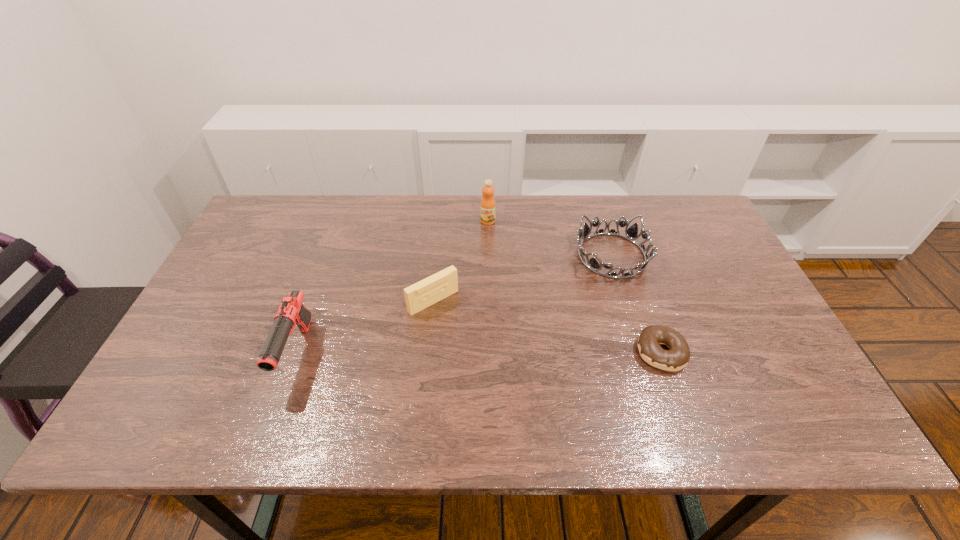
Locate an element on the screen. The height and width of the screenshot is (540, 960). free space between the farthest object and the videotape is located at coordinates (461, 261).

Image resolution: width=960 pixels, height=540 pixels. Identify the location of free spot between the second farthest object and the fourth object from right to left. (522, 278).

Where is `free spot between the third object from right to left and the gun`? free spot between the third object from right to left and the gun is located at coordinates (393, 287).

This screenshot has height=540, width=960. I want to click on empty space between the leftmost object and the third object from left to right, so click(393, 287).

The width and height of the screenshot is (960, 540). I want to click on vacant space that is in between the second farthest object and the third object from left to right, so (x=550, y=238).

Where is `free space between the farthest object and the tiara`? This screenshot has height=540, width=960. free space between the farthest object and the tiara is located at coordinates (550, 238).

The image size is (960, 540). Find the location of `empty space that is in between the doughnut and the tiara`. empty space that is in between the doughnut and the tiara is located at coordinates (637, 304).

Locate an element on the screen. vacant area that lies between the tiara and the leftmost object is located at coordinates (454, 304).

Where is `the closest object to the leftmost object`? Image resolution: width=960 pixels, height=540 pixels. the closest object to the leftmost object is located at coordinates (442, 284).

Locate which object ranks second in proximity to the doughnut. Please provide its 2D coordinates. Your answer should be formatted as a tuple, i.e. [(x, y)], where the tuple contains the x and y coordinates of a point satisfying the conditions above.

[(442, 284)]